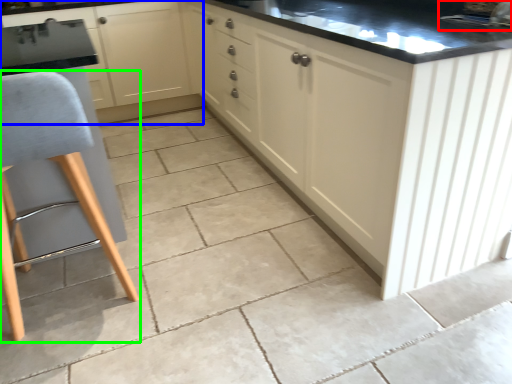
Question: Estimate the real-world distances between objects in this image. Which object is farther from sink (highlighted by a red box), cabinetry (highlighted by a blue box) or furniture (highlighted by a green box)?

Choices:
 (A) cabinetry
 (B) furniture

Answer: (A)